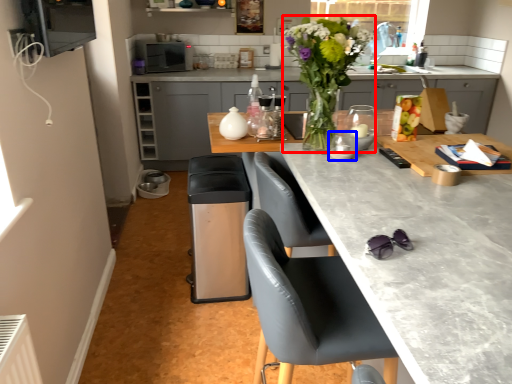
Question: Which of the following is the closest to the observer, floral arrangement (highlighted by a red box) or appliance (highlighted by a blue box)?

Choices:
 (A) floral arrangement
 (B) appliance

Answer: (A)